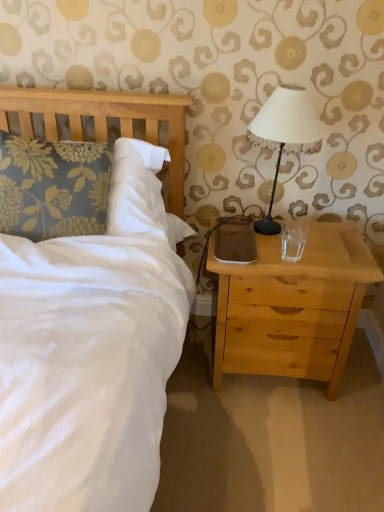
Question: Is light wood nightstand at right to the left or to the right of white fabric-covered lampshade at upper right in the image?

Choices:
 (A) left
 (B) right

Answer: (B)

Question: Is point (289, 293) positioned closer to the camera than point (314, 146)?

Choices:
 (A) closer
 (B) farther

Answer: (A)

Question: Estimate the real-world distances between objects in this image. Which object is farther from the transparent glass at right?

Choices:
 (A) white fabric-covered lampshade at upper right
 (B) floral fabric pillow at left
 (C) brown matte pad at right
 (D) light wood nightstand at right

Answer: (B)

Question: Estimate the real-world distances between objects in this image. Which object is farther from the floral fabric pillow at left?

Choices:
 (A) white fabric-covered lampshade at upper right
 (B) brown matte pad at right
 (C) light wood nightstand at right
 (D) transparent glass at right

Answer: (D)